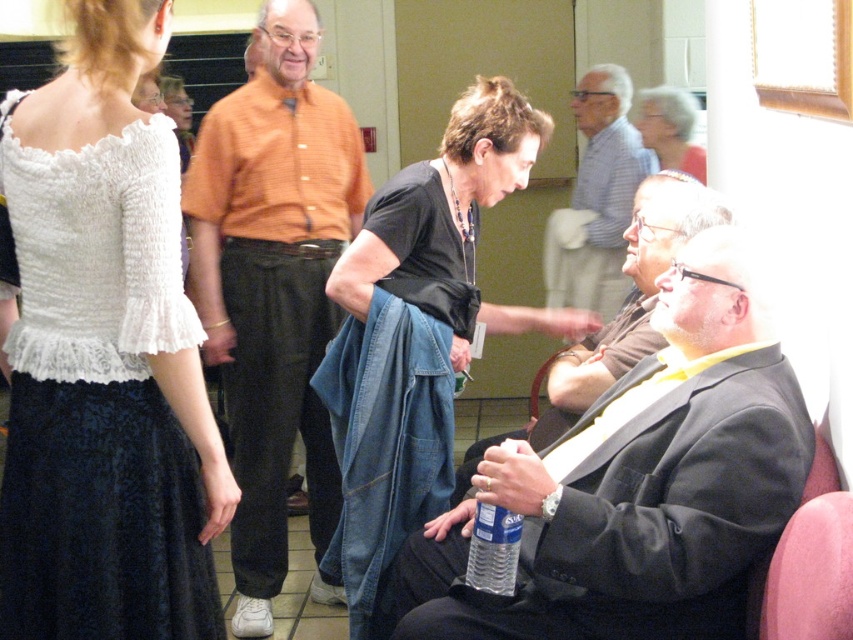
Question: Is black jersey at center positioned before gray striped shirt at upper center?

Choices:
 (A) no
 (B) yes

Answer: (B)

Question: Which point is farther to the camera?

Choices:
 (A) gray hair at upper right
 (B) black suit jacket at lower right
 (C) gray striped shirt at upper center
 (D) pink fabric chair at lower right

Answer: (C)

Question: Is white lace dress at upper left positioned in front of dark gray suit at center?

Choices:
 (A) no
 (B) yes

Answer: (B)

Question: Does white lace dress at upper left appear under gray hair at upper right?

Choices:
 (A) no
 (B) yes

Answer: (B)

Question: Which point appears farthest from the camera in this image?

Choices:
 (A) (212, 164)
 (B) (608, 272)
 (C) (645, 586)

Answer: (B)

Question: Which object is farther from the camera taking this photo?

Choices:
 (A) orange striped shirt at center
 (B) pink fabric chair at lower right
 (C) dark gray suit at center
 (D) black jersey at center

Answer: (A)